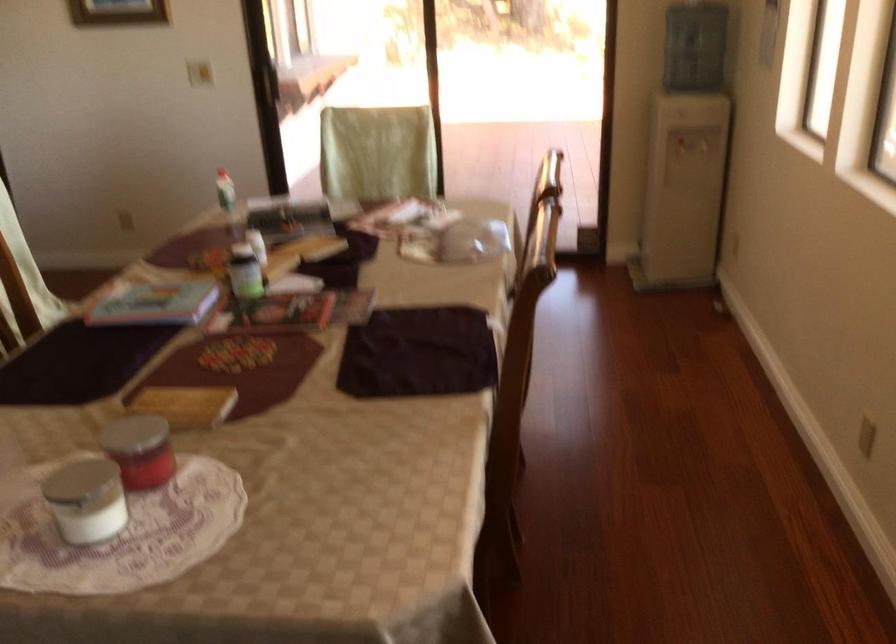
Locate an element on the screen. This screenshot has width=896, height=644. red dispenser lever is located at coordinates (149, 458).